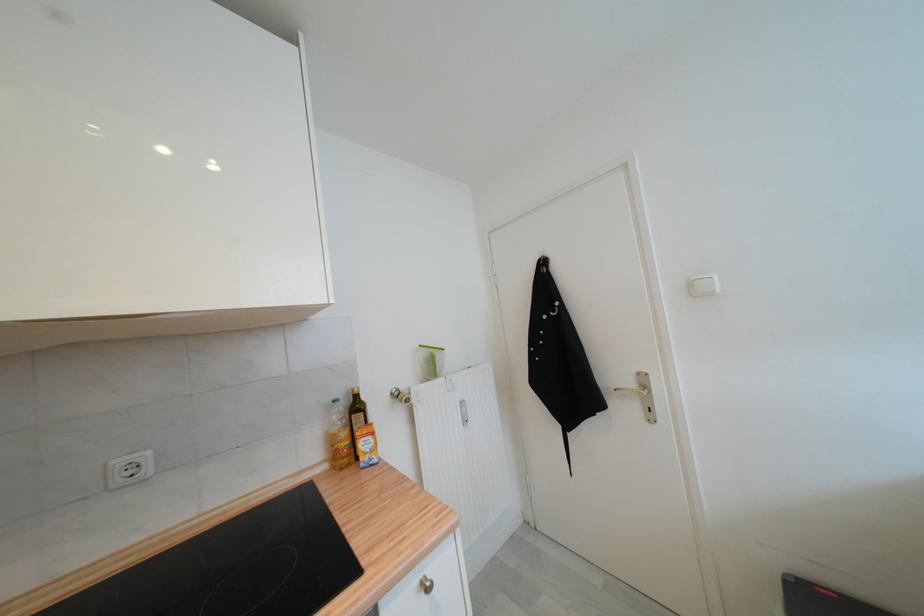
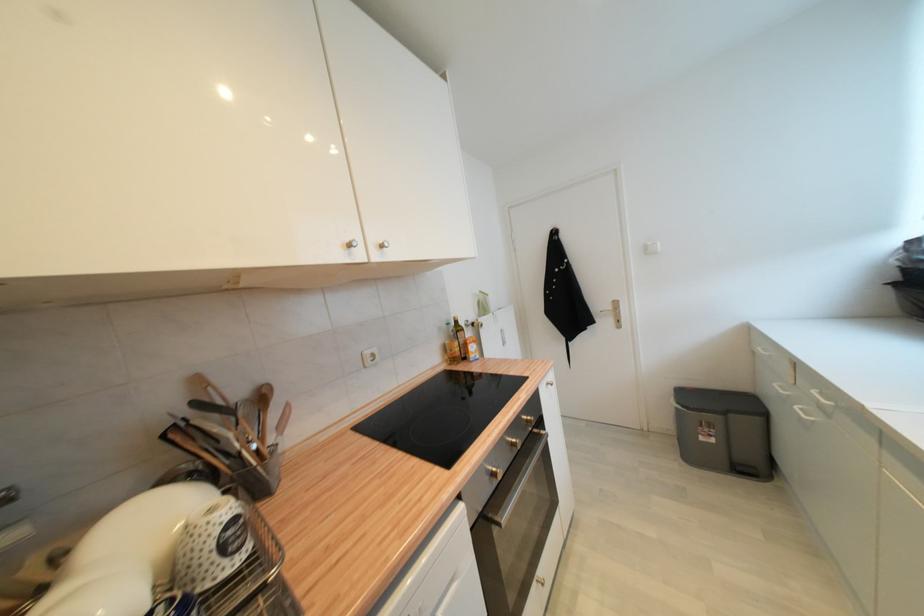
Which direction would the cameraman need to move to produce the second image?

The cameraman walked toward left, backward.